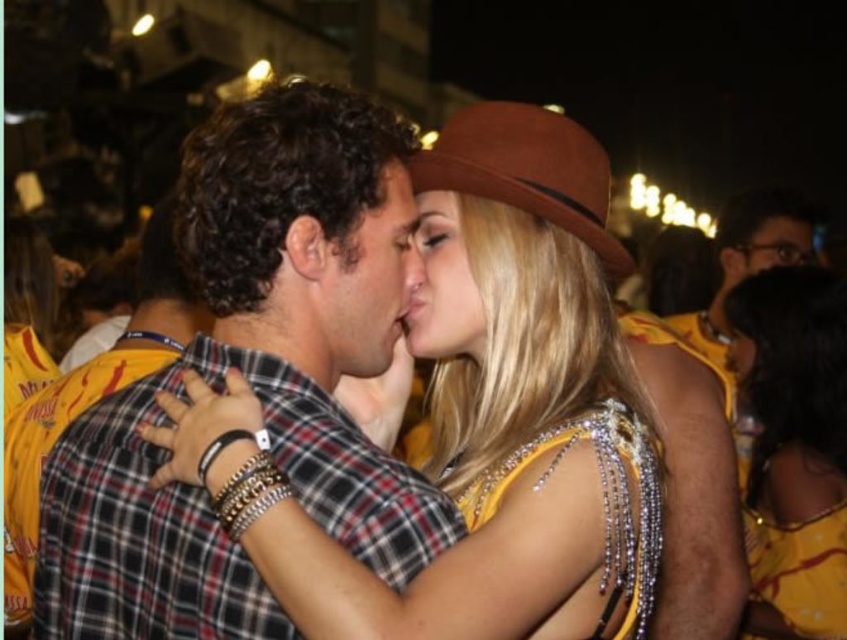
Which is behind, point (519, 113) or point (753, 272)?

Point (753, 272)

Does point (584, 154) come behind point (735, 266)?

That is False.

Find the location of a particular element. The height and width of the screenshot is (640, 847). brown felt cowboy hat at upper center is located at coordinates (527, 170).

Locate an element on the screen. The image size is (847, 640). matte brown hat at center is located at coordinates (369, 280).

You are a GUI agent. You are given a task and a screenshot of the screen. Output one action in this format:
    pyautogui.click(x=<x>, y=<y>)
    Task: Click on the matte brown hat at center
    
    Given the screenshot: What is the action you would take?
    pyautogui.click(x=369, y=280)

Is plaid fabric shirt at center above smooth tan hat at center?

Incorrect, plaid fabric shirt at center is not positioned above smooth tan hat at center.

Is plaid fabric shirt at center closer to camera compared to smooth tan hat at center?

Yes, it is in front of smooth tan hat at center.

What do you see at coordinates (92, 396) in the screenshot?
I see `plaid fabric shirt at center` at bounding box center [92, 396].

The height and width of the screenshot is (640, 847). In order to click on plaid fabric shirt at center in this screenshot , I will do `click(92, 396)`.